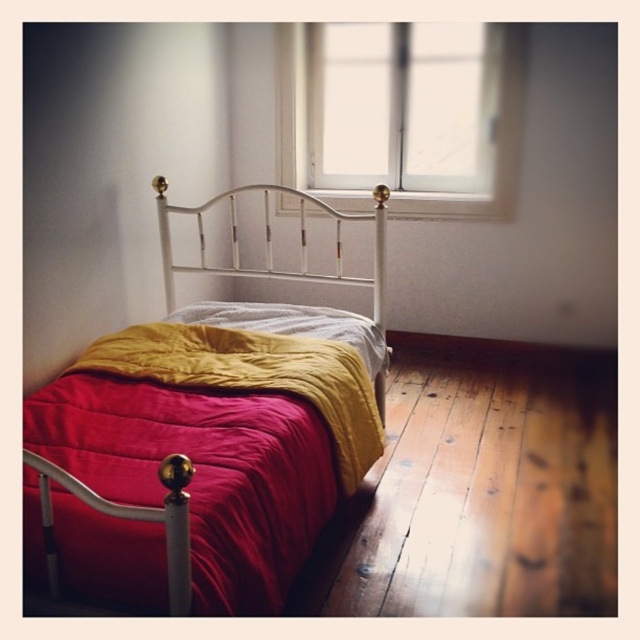
You are standing at the point marked as point (x=385, y=132) in the bedroom. You need to move to the bed. Can you walk directly to the bed from your current position without any obstacles? Explain your reasoning.

The distance between the point (x=385, y=132) and the bed is 3.31 meters. Since there are no obstacles mentioned in the scene description, you can walk directly to the bed from the given point.

You are standing in the bedroom and want to place a small nightstand between the matte white metal bed at center and the velvet red blanket at center. Is this possible?

The matte white metal bed at center is in front of the velvet red blanket at center, meaning the blanket is likely behind the bed. Since the bed is in front, there is no space between them for the nightstand to be placed here.

You are standing in the bedroom and want to determine which of the two points, point (321, 412) or point (202, 225), is nearer to you. Based on the scene description, which point is closer?

Point (321, 412) is closer to the viewer than point (202, 225).